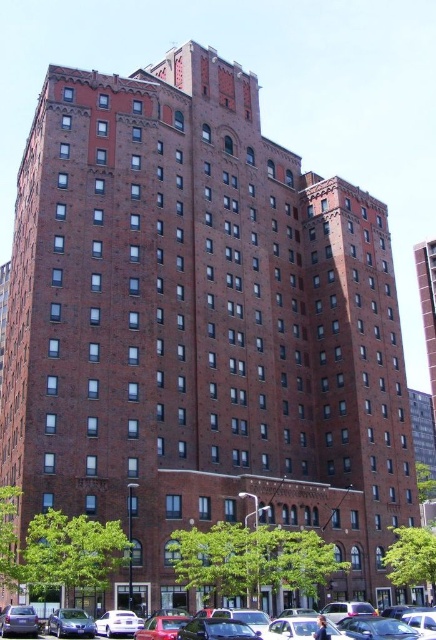
You are a delivery person trying to park your 1.8 meter tall delivery van. You see the matte red car at center and the metallic blue sedan at lower left in the parking lot. Which parking spot between the two cars would allow your van to fit vertically without hitting the roof?

The metallic blue sedan at lower left is shorter than the matte red car at center. Since your van is 1.8 meters tall, you should choose the parking spot near the metallic blue sedan at lower left as it has enough vertical clearance.

You are standing in front of the building and want to park your car. The matte red car at center is blocking the entrance. Can you drive around it to reach the entrance without moving the metallic blue sedan at lower left?

The matte red car at center is closer to the viewer than the metallic blue sedan at lower left, so you can drive around the matte red car at center to reach the entrance without moving the metallic blue sedan at lower left.

You are standing on the sidewalk in front of the building and see both the metallic blue sedan at lower left and the matte blue sedan at lower left. Which one is closer to you?

The metallic blue sedan at lower left is closer to you because it is further to the viewer than the matte blue sedan at lower left.